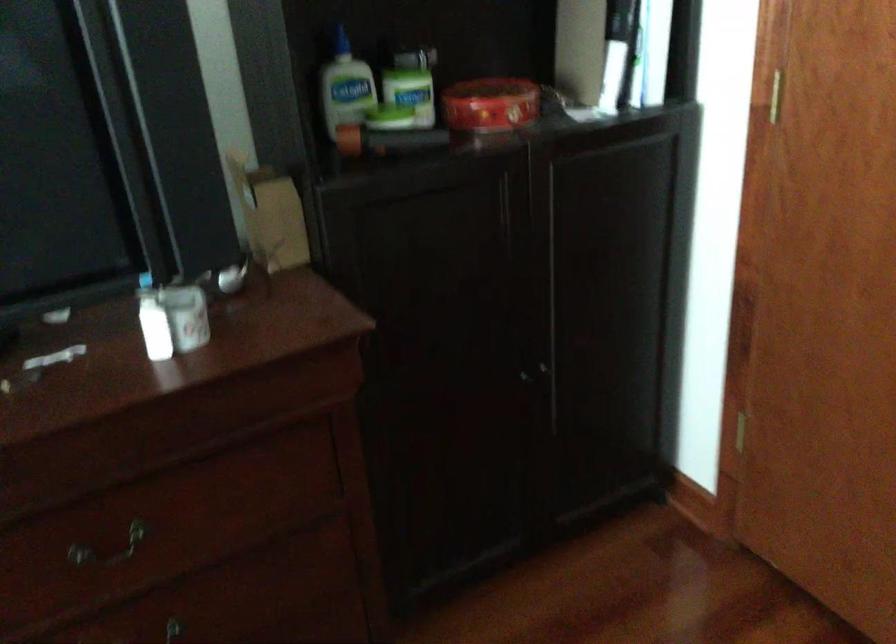
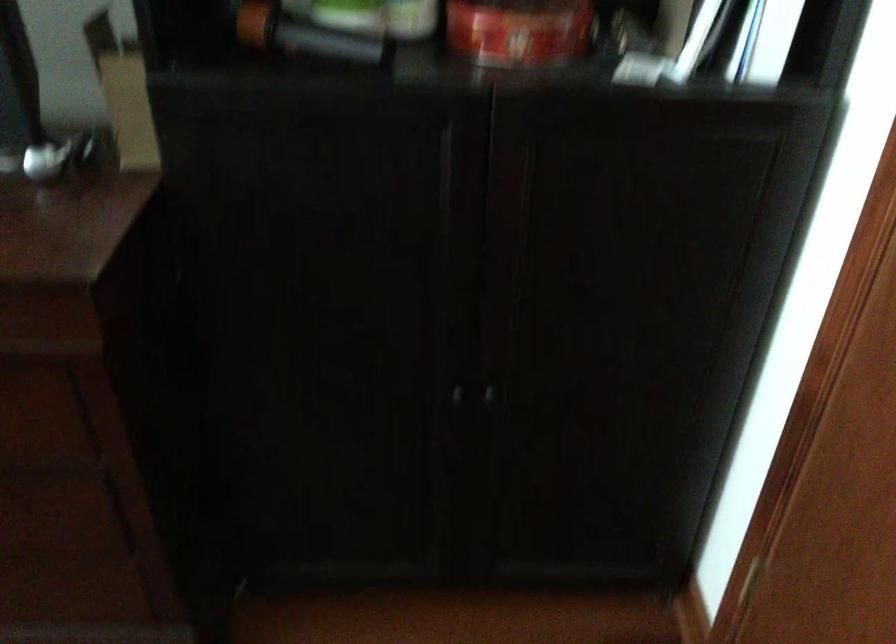
The point at (x=386, y=144) is marked in the first image. Where is the corresponding point in the second image?

(304, 35)